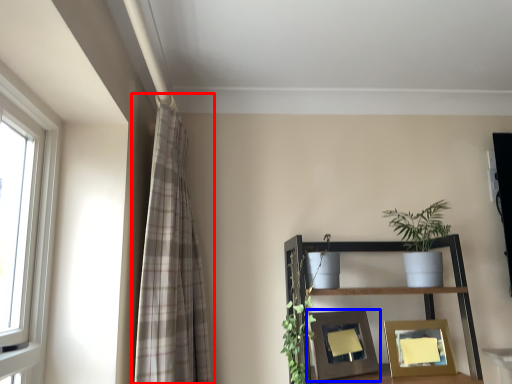
Question: Which of the following is the farthest to the observer, curtain (highlighted by a red box) or picture frame (highlighted by a blue box)?

Choices:
 (A) curtain
 (B) picture frame

Answer: (B)